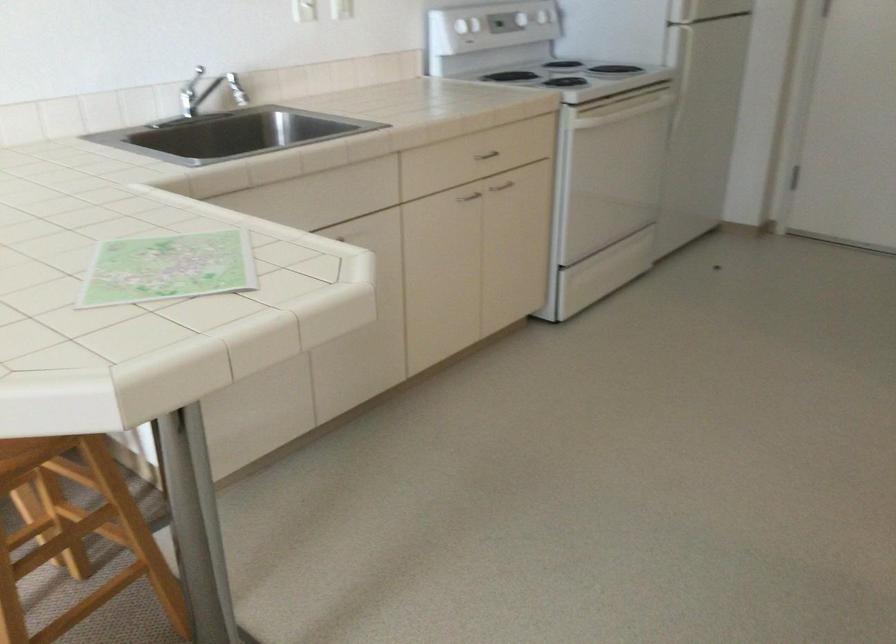
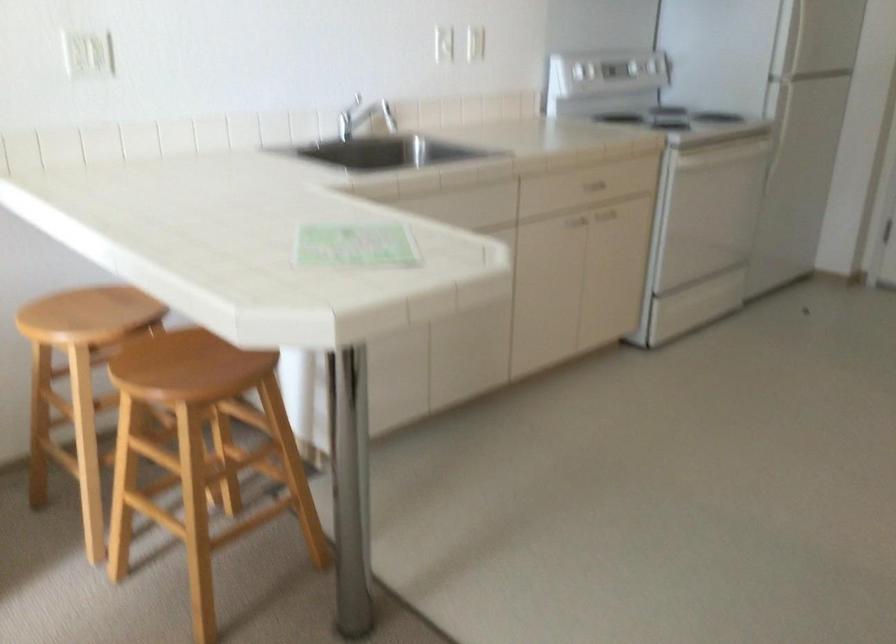
Find the pixel in the second image that matches (610,165) in the first image.

(714, 202)